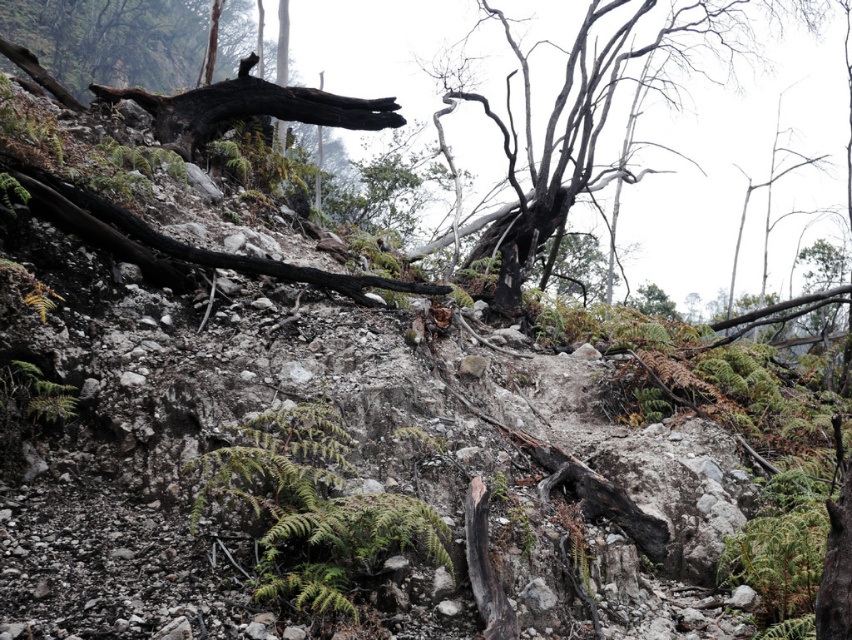
Between green fuzzy fern at center and charcoal textured tree at center, which one is positioned lower?

green fuzzy fern at center is below.

In order to click on green fuzzy fern at center in this screenshot , I will do `click(312, 508)`.

The image size is (852, 640). I want to click on green fuzzy fern at center, so click(312, 508).